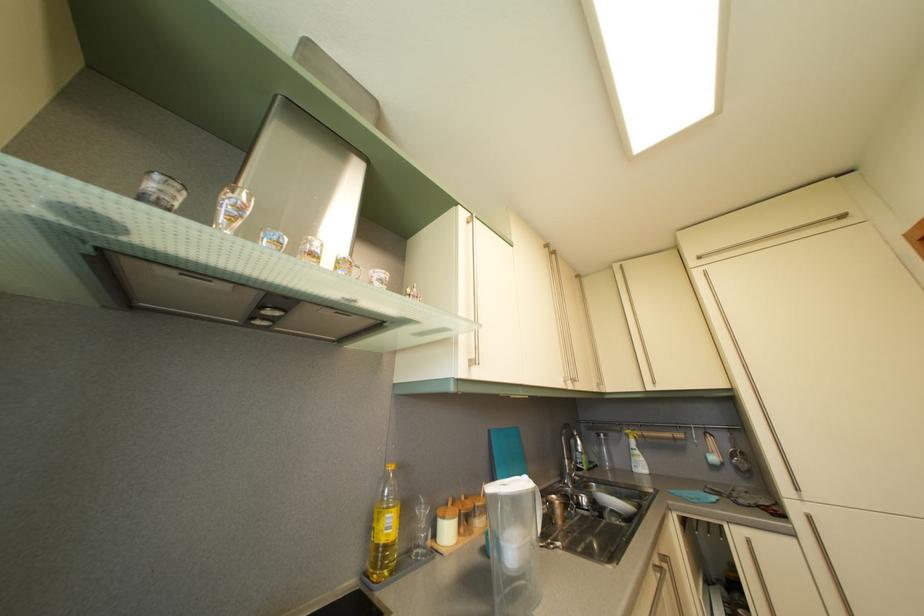
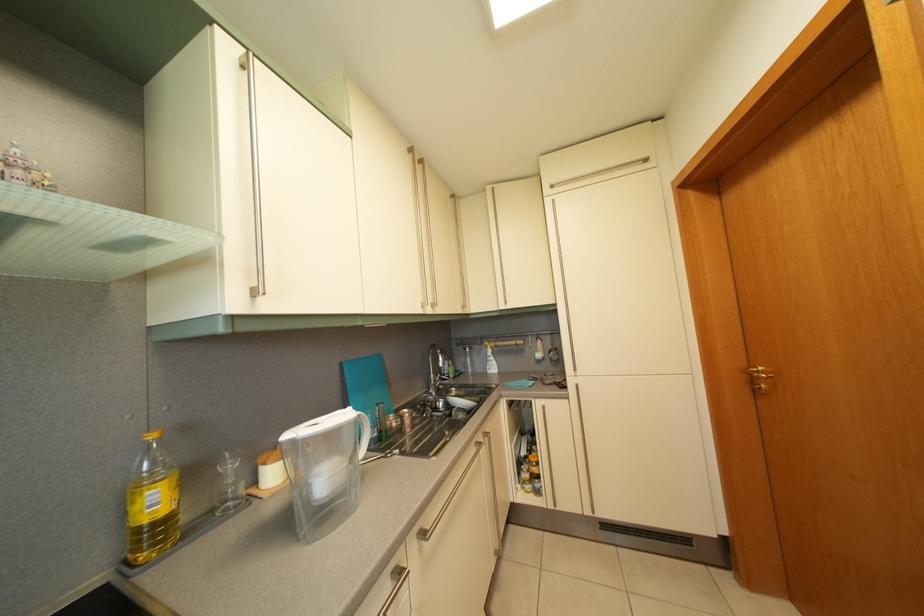
Question: What movement of the cameraman would produce the second image?

Choices:
 (A) Left
 (B) Right
 (C) Forward
 (D) Backward

Answer: (B)